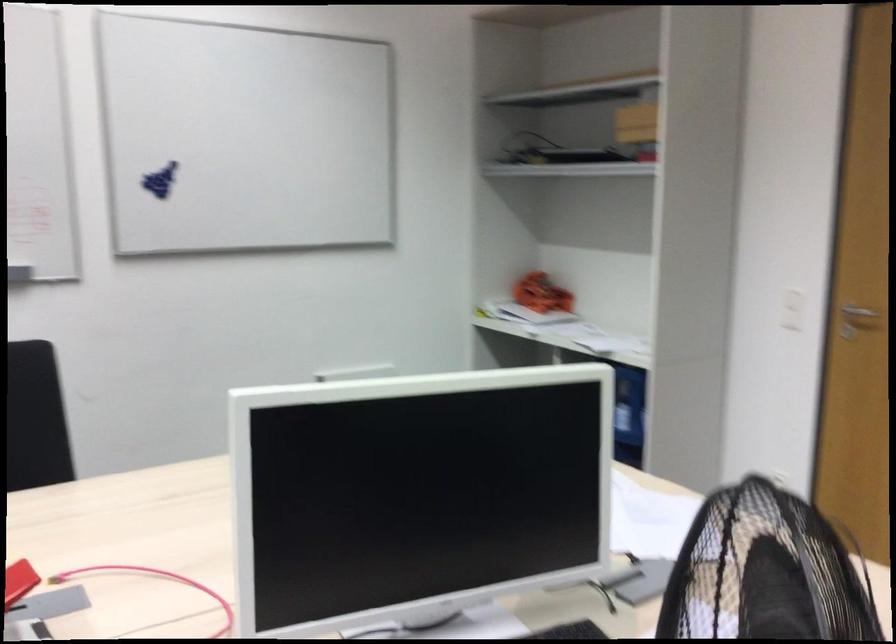
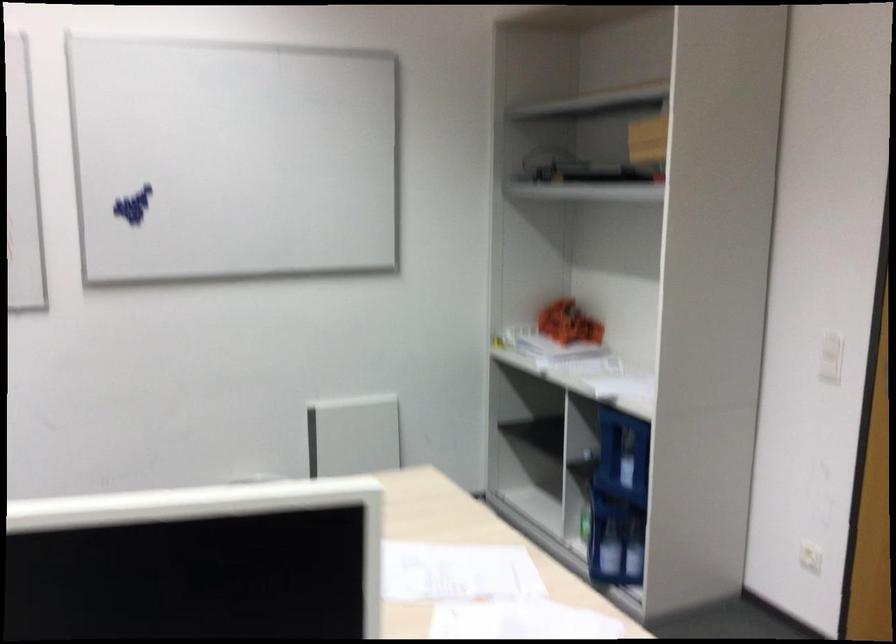
Question: How did the camera likely rotate?

Choices:
 (A) Left
 (B) Right
 (C) Up
 (D) Down

Answer: (A)